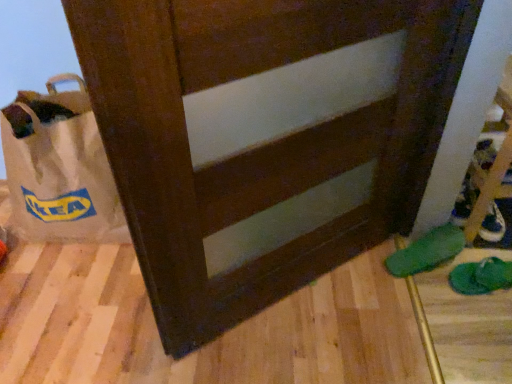
Question: Considering the relative sizes of white leather shoe at lower right and green fabric slipper at lower right, the second footwear from the right, in the image provided, is white leather shoe at lower right thinner than green fabric slipper at lower right, the second footwear from the right,?

Choices:
 (A) yes
 (B) no

Answer: (A)

Question: Is green fabric slipper at lower right, which is counted as the first footwear, starting from the left, a part of white leather shoe at lower right?

Choices:
 (A) yes
 (B) no

Answer: (B)

Question: Would you say white leather shoe at lower right is a long distance from green fabric slipper at lower right, the second footwear from the right?

Choices:
 (A) yes
 (B) no

Answer: (B)

Question: Can you confirm if white leather shoe at lower right is positioned to the left of green fabric slipper at lower right, the second footwear from the right?

Choices:
 (A) yes
 (B) no

Answer: (B)

Question: From the image's perspective, does white leather shoe at lower right appear higher than green fabric slipper at lower right, which is counted as the first footwear, starting from the left?

Choices:
 (A) no
 (B) yes

Answer: (B)

Question: From the image's perspective, is white leather shoe at lower right located beneath green fabric slipper at lower right, the second footwear from the right?

Choices:
 (A) yes
 (B) no

Answer: (B)

Question: Would you say white leather shoe at lower right is outside white paper bag at left?

Choices:
 (A) no
 (B) yes

Answer: (B)

Question: Can you confirm if white leather shoe at lower right is smaller than white paper bag at left?

Choices:
 (A) yes
 (B) no

Answer: (A)

Question: Is white leather shoe at lower right bigger than white paper bag at left?

Choices:
 (A) yes
 (B) no

Answer: (B)

Question: From the image's perspective, does white leather shoe at lower right appear lower than white paper bag at left?

Choices:
 (A) yes
 (B) no

Answer: (A)

Question: Does white leather shoe at lower right lie behind white paper bag at left?

Choices:
 (A) no
 (B) yes

Answer: (B)

Question: Considering the relative positions of white leather shoe at lower right and white paper bag at left in the image provided, is white leather shoe at lower right to the right of white paper bag at left from the viewer's perspective?

Choices:
 (A) yes
 (B) no

Answer: (A)

Question: Considering the relative sizes of green fabric slipper at lower right, acting as the second footwear starting from the left, and green fabric slipper at lower right, which is counted as the first footwear, starting from the left, in the image provided, is green fabric slipper at lower right, acting as the second footwear starting from the left, bigger than green fabric slipper at lower right, which is counted as the first footwear, starting from the left,?

Choices:
 (A) no
 (B) yes

Answer: (A)